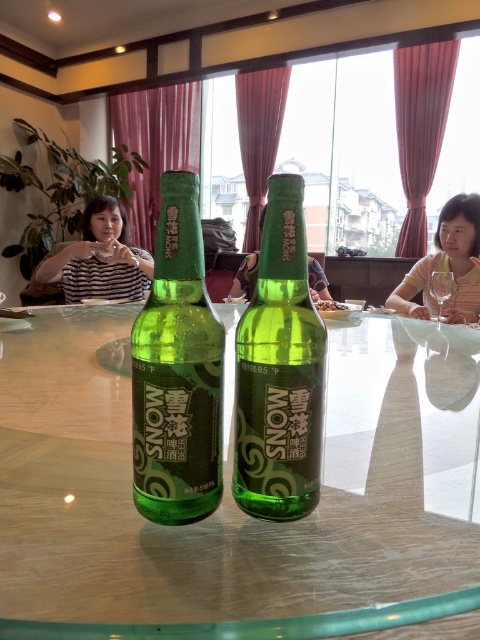
Question: Which is nearer to the green matte bottle at center?

Choices:
 (A) striped fabric at left
 (B) transparent glass wine glass at center
 (C) green glass table at center
 (D) striped fabric shirt at right

Answer: (C)

Question: Does green glass table at center appear on the left side of green glass bottle at center?

Choices:
 (A) no
 (B) yes

Answer: (A)

Question: Which point is closer to the camera?

Choices:
 (A) (456, 291)
 (B) (70, 598)

Answer: (B)

Question: Observing the image, what is the correct spatial positioning of green glass bottle at center in reference to transparent glass wine glass at center?

Choices:
 (A) right
 (B) left

Answer: (B)

Question: Among these objects, which one is farthest from the camera?

Choices:
 (A) transparent glass wine glass at center
 (B) green glass table at center
 (C) striped fabric at left

Answer: (C)

Question: Can you confirm if green matte bottle at center is positioned above green glass bottle at center?

Choices:
 (A) yes
 (B) no

Answer: (A)